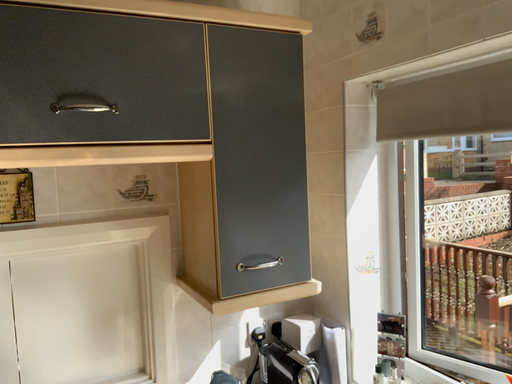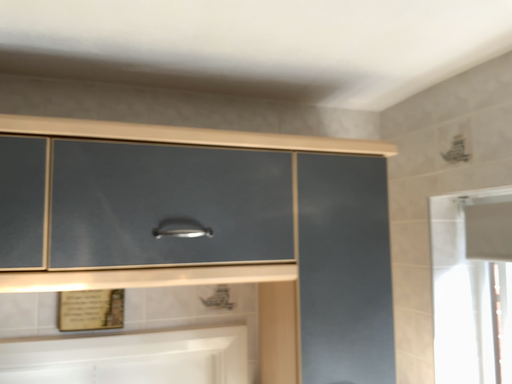
Question: How did the camera likely rotate when shooting the video?

Choices:
 (A) rotated right
 (B) rotated left

Answer: (B)